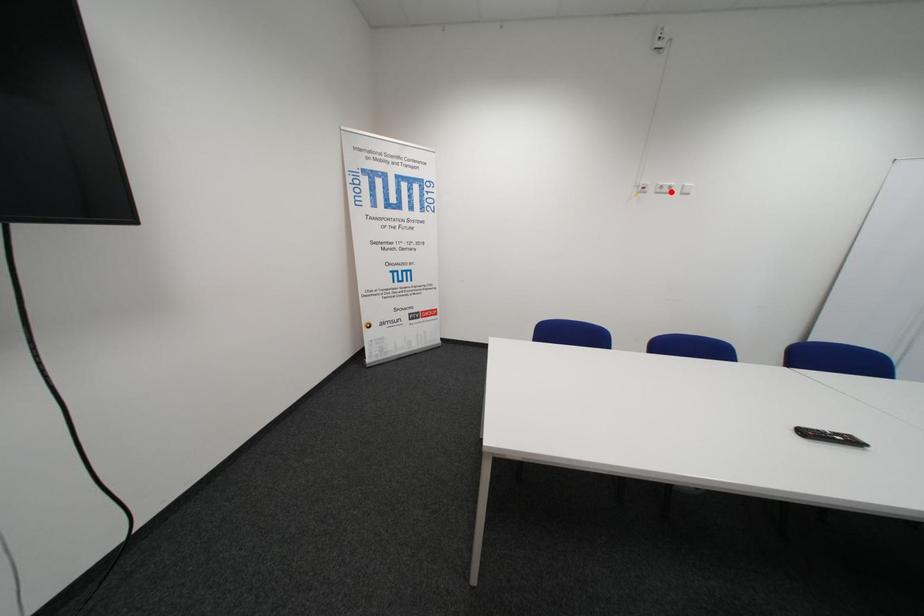
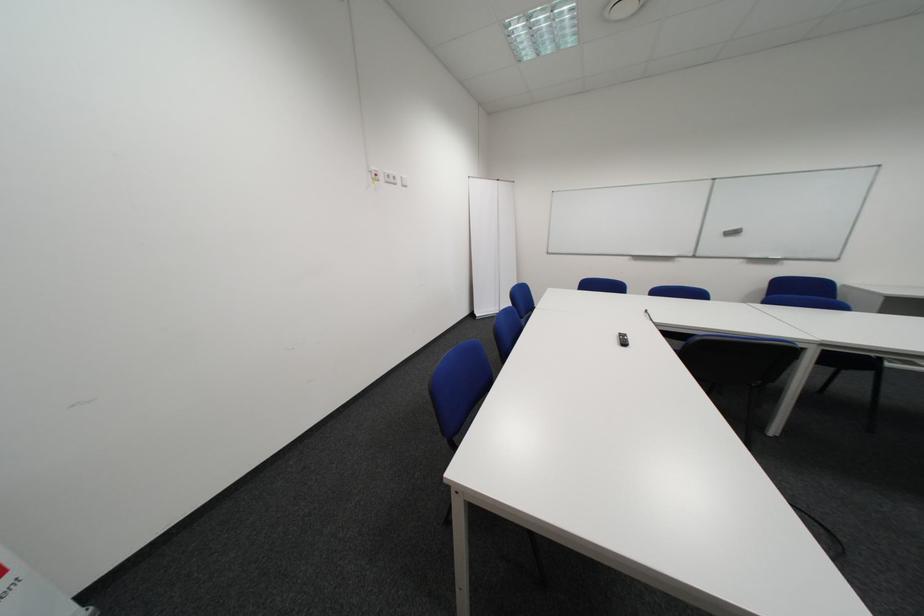
In the second image, find the point that corresponds to the highlighted location in the first image.

(398, 180)